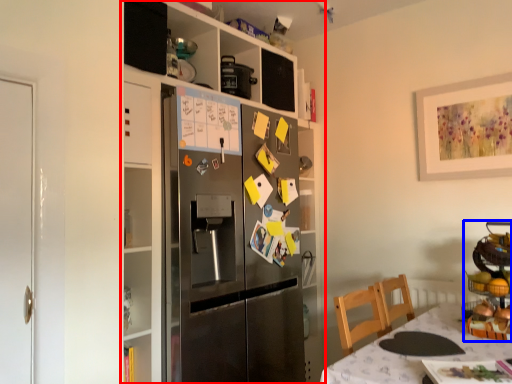
Question: Among these objects, which one is nearest to the camera, cabinetry (highlighted by a red box) or appliance (highlighted by a blue box)?

Choices:
 (A) cabinetry
 (B) appliance

Answer: (B)